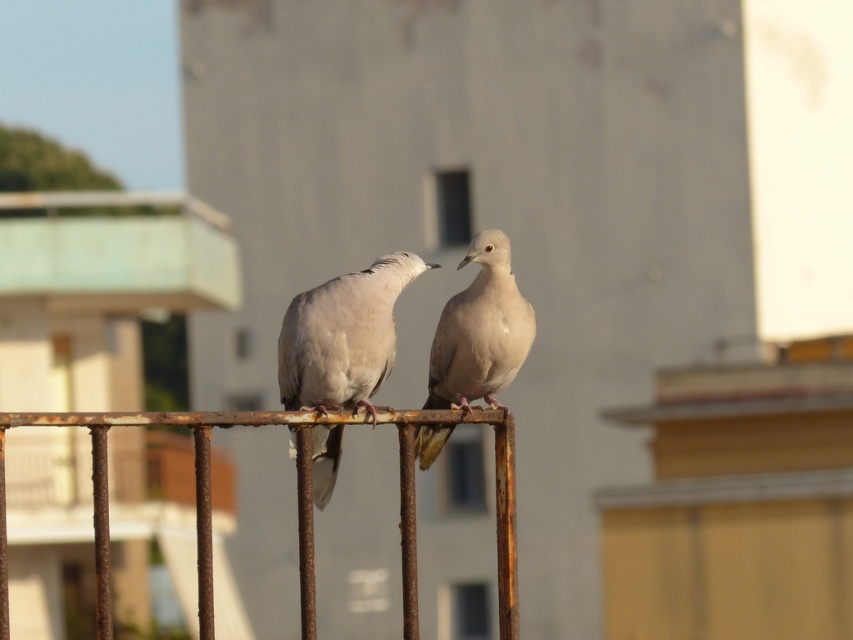
Question: Which object appears closest to the camera in this image?

Choices:
 (A) rusty metal fence at center
 (B) matte white dove at center

Answer: (B)

Question: Is rusty metal fence at center positioned before light beige feathered dove at center?

Choices:
 (A) no
 (B) yes

Answer: (B)

Question: In this image, where is rusty metal fence at center located relative to matte white dove at center?

Choices:
 (A) below
 (B) above

Answer: (A)

Question: Estimate the real-world distances between objects in this image. Which object is closer to the rusty metal fence at center?

Choices:
 (A) matte white dove at center
 (B) light beige feathered dove at center

Answer: (A)

Question: From the image, what is the correct spatial relationship of rusty metal fence at center in relation to light beige feathered dove at center?

Choices:
 (A) above
 (B) below

Answer: (B)

Question: Which point appears closest to the camera in this image?

Choices:
 (A) (479, 298)
 (B) (209, 570)

Answer: (B)